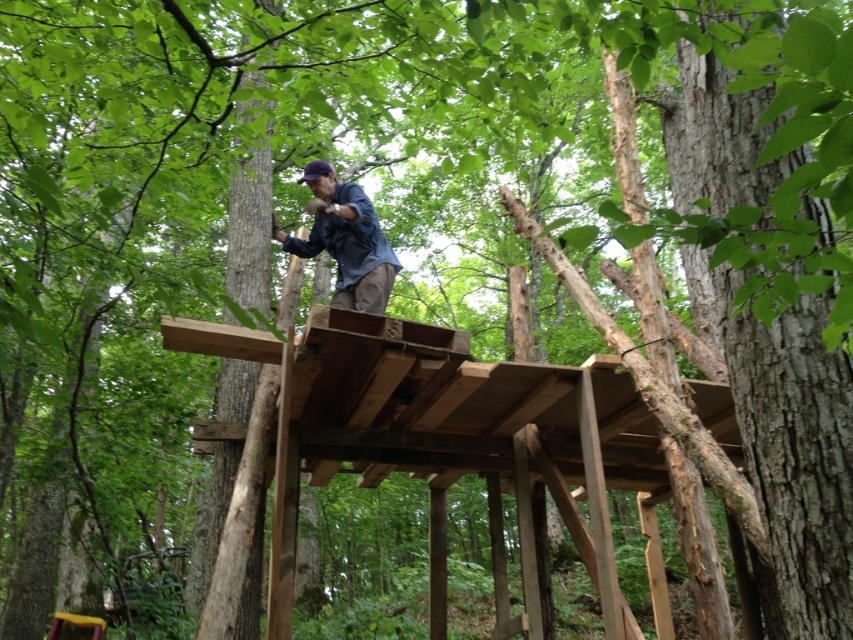
Question: Is natural wood platform at center to the right of blue denim shirt at center from the viewer's perspective?

Choices:
 (A) yes
 (B) no

Answer: (A)

Question: Among these points, which one is nearest to the camera?

Choices:
 (A) (622, 436)
 (B) (387, 288)

Answer: (B)

Question: Observing the image, what is the correct spatial positioning of natural wood platform at center in reference to blue denim shirt at center?

Choices:
 (A) below
 (B) above

Answer: (A)

Question: Which object is farther from the camera taking this photo?

Choices:
 (A) natural wood platform at center
 (B) blue denim shirt at center

Answer: (B)

Question: Is natural wood platform at center to the right of blue denim shirt at center from the viewer's perspective?

Choices:
 (A) yes
 (B) no

Answer: (A)